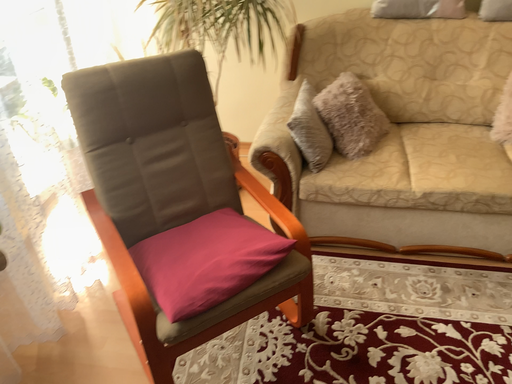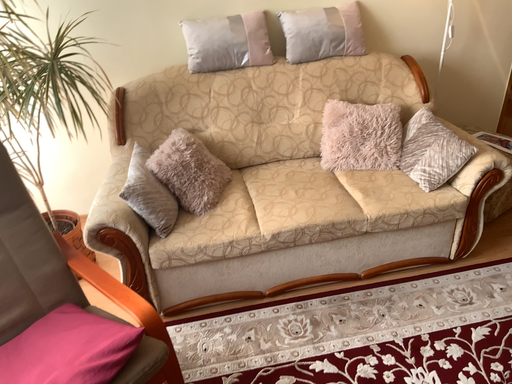
Question: How did the camera likely rotate when shooting the video?

Choices:
 (A) rotated upward
 (B) rotated downward

Answer: (A)